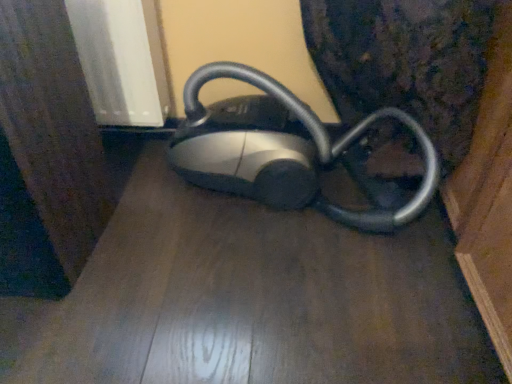
Question: Does matte black vacuum cleaner at center have a smaller size compared to silver metallic vacuum cleaner at center?

Choices:
 (A) no
 (B) yes

Answer: (B)

Question: Can you confirm if matte black vacuum cleaner at center is positioned to the left of silver metallic vacuum cleaner at center?

Choices:
 (A) yes
 (B) no

Answer: (A)

Question: Does matte black vacuum cleaner at center come behind silver metallic vacuum cleaner at center?

Choices:
 (A) yes
 (B) no

Answer: (B)

Question: Is silver metallic vacuum cleaner at center at the back of matte black vacuum cleaner at center?

Choices:
 (A) yes
 (B) no

Answer: (B)

Question: Are matte black vacuum cleaner at center and silver metallic vacuum cleaner at center far apart?

Choices:
 (A) yes
 (B) no

Answer: (B)

Question: From a real-world perspective, is matte black vacuum cleaner at center over silver metallic vacuum cleaner at center?

Choices:
 (A) no
 (B) yes

Answer: (A)

Question: Considering the relative positions of silver metallic vacuum cleaner at center and matte black vacuum cleaner at center in the image provided, is silver metallic vacuum cleaner at center to the left of matte black vacuum cleaner at center from the viewer's perspective?

Choices:
 (A) yes
 (B) no

Answer: (B)

Question: Does silver metallic vacuum cleaner at center have a smaller size compared to matte black vacuum cleaner at center?

Choices:
 (A) yes
 (B) no

Answer: (B)

Question: Can you confirm if silver metallic vacuum cleaner at center is thinner than matte black vacuum cleaner at center?

Choices:
 (A) no
 (B) yes

Answer: (B)

Question: Is silver metallic vacuum cleaner at center not near matte black vacuum cleaner at center?

Choices:
 (A) no
 (B) yes

Answer: (A)

Question: From a real-world perspective, is silver metallic vacuum cleaner at center positioned over matte black vacuum cleaner at center based on gravity?

Choices:
 (A) yes
 (B) no

Answer: (A)

Question: Considering the relative sizes of silver metallic vacuum cleaner at center and matte black vacuum cleaner at center in the image provided, is silver metallic vacuum cleaner at center bigger than matte black vacuum cleaner at center?

Choices:
 (A) yes
 (B) no

Answer: (A)

Question: In terms of height, does silver metallic vacuum cleaner at center look taller or shorter compared to matte black vacuum cleaner at center?

Choices:
 (A) short
 (B) tall

Answer: (B)